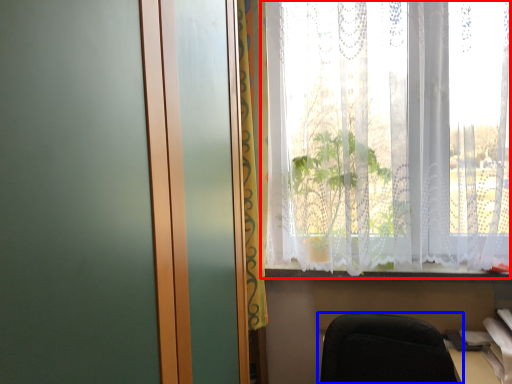
Question: Which of the following is the farthest to the observer, window (highlighted by a red box) or chair (highlighted by a blue box)?

Choices:
 (A) window
 (B) chair

Answer: (A)